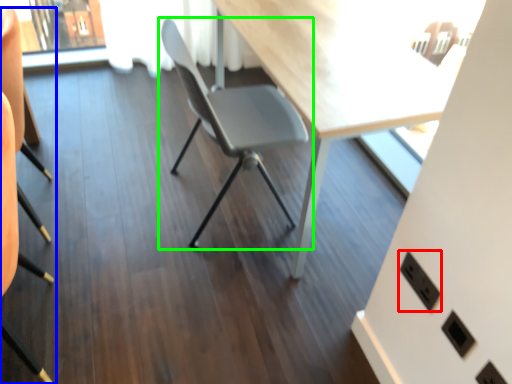
Question: Estimate the real-world distances between objects in this image. Which object is farther from electric outlet (highlighted by a red box), chair (highlighted by a blue box) or chair (highlighted by a green box)?

Choices:
 (A) chair
 (B) chair

Answer: (A)